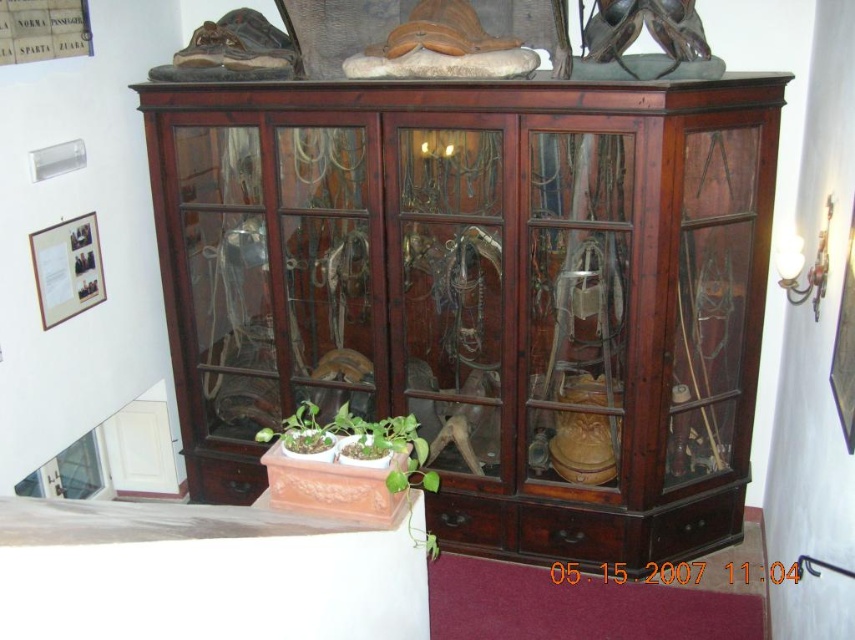
Is green matte pot at lower center bigger than green matte plant at center?

No, green matte pot at lower center is not bigger than green matte plant at center.

Is green matte pot at lower center wider than green matte plant at center?

In fact, green matte pot at lower center might be narrower than green matte plant at center.

This screenshot has width=855, height=640. I want to click on green matte pot at lower center, so click(x=345, y=461).